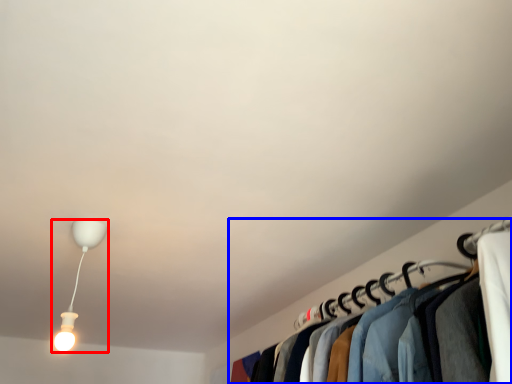
Question: Which of the following is the farthest to the observer, lamp (highlighted by a red box) or closet (highlighted by a blue box)?

Choices:
 (A) lamp
 (B) closet

Answer: (A)